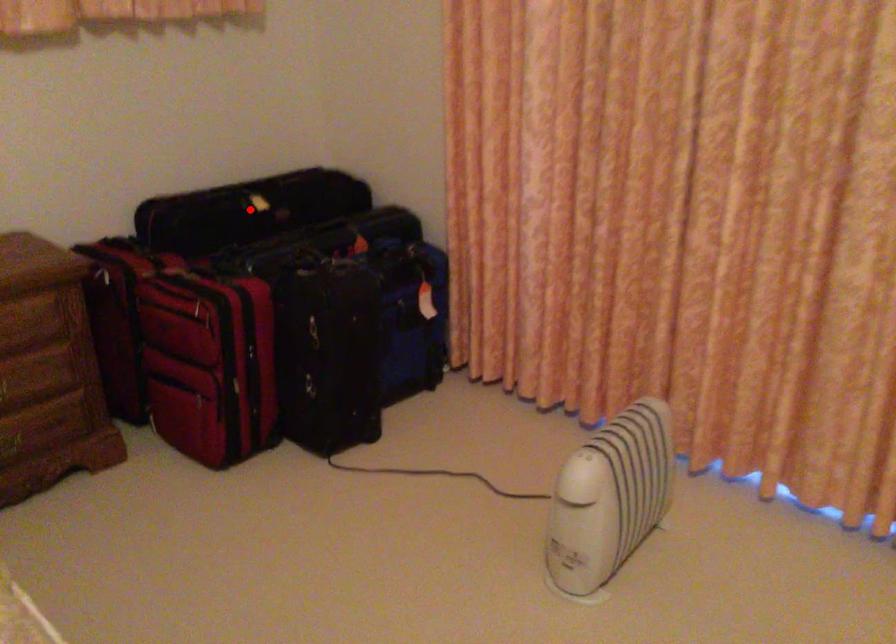
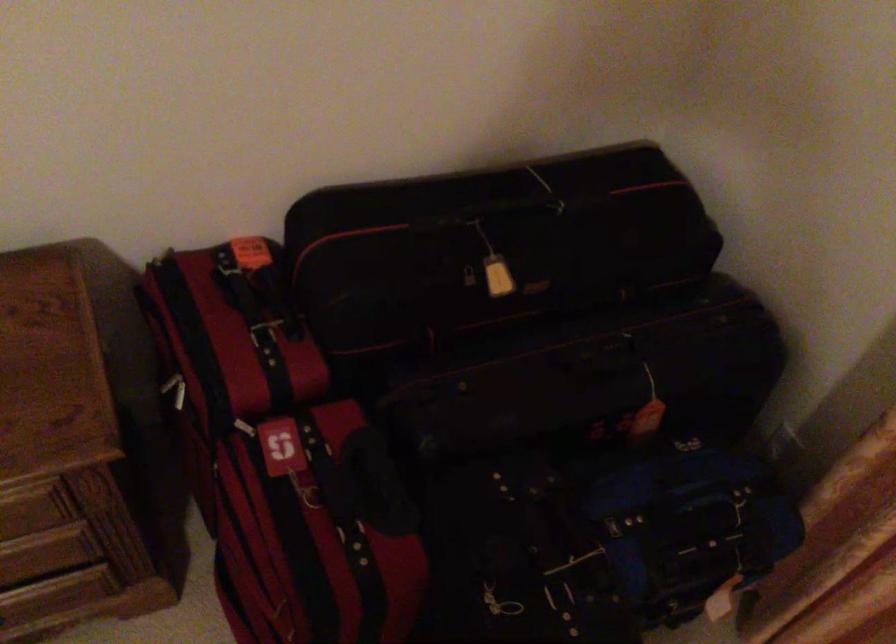
Where in the second image is the point corresponding to the highlighted location from the first image?

(470, 287)